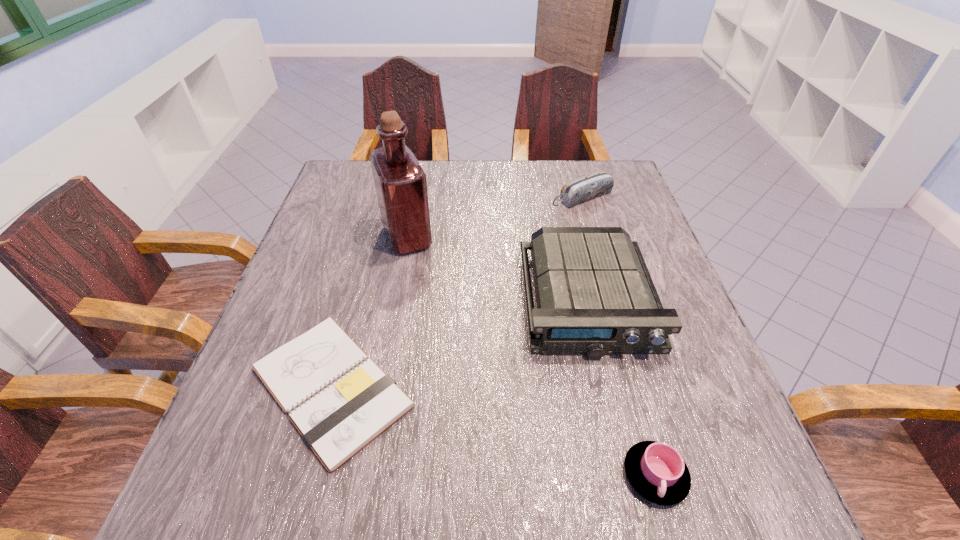
Locate an element on the screen. empty space that is in between the shortest object and the second tallest object is located at coordinates (460, 345).

This screenshot has height=540, width=960. I want to click on vacant space in between the cup and the second tallest object, so click(x=621, y=388).

The height and width of the screenshot is (540, 960). What are the coordinates of `unoccupied area between the fourth tallest object and the liquor` in the screenshot? It's located at (531, 356).

This screenshot has width=960, height=540. I want to click on unoccupied area between the shortest object and the tallest object, so click(x=370, y=312).

The image size is (960, 540). What are the coordinates of `free space that is in between the radio receiver and the liquor` in the screenshot? It's located at (497, 269).

You are a GUI agent. You are given a task and a screenshot of the screen. Output one action in this format:
    pyautogui.click(x=<x>, y=<y>)
    Task: Click on the empty space that is in between the tallest object and the second tallest object
    Image resolution: width=960 pixels, height=540 pixels.
    Given the screenshot: What is the action you would take?
    pyautogui.click(x=497, y=269)

Identify which object is located as the fourth nearest to the cup. Please provide its 2D coordinates. Your answer should be formatted as a tuple, i.e. [(x, y)], where the tuple contains the x and y coordinates of a point satisfying the conditions above.

[(591, 186)]

Select which object is the third closest to the shortest object. Please provide its 2D coordinates. Your answer should be formatted as a tuple, i.e. [(x, y)], where the tuple contains the x and y coordinates of a point satisfying the conditions above.

[(656, 470)]